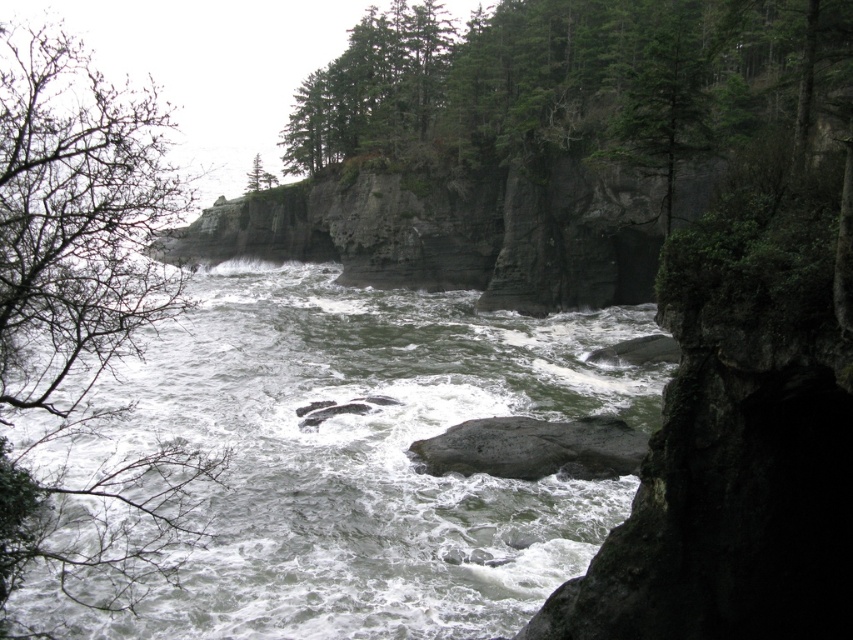
Who is more forward, (109, 211) or (518, 458)?

Point (109, 211) is in front.

Does bare branches at left appear on the left side of gray rough rock at center?

Yes, bare branches at left is to the left of gray rough rock at center.

I want to click on bare branches at left, so click(82, 317).

Is greenish-gray water at center wider than green matte tree at upper center?

No.

Who is higher up, greenish-gray water at center or green matte tree at upper center?

Positioned higher is green matte tree at upper center.

Who is more forward, (329, 593) or (259, 164)?

Point (329, 593) is more forward.

You are a GUI agent. You are given a task and a screenshot of the screen. Output one action in this format:
    pyautogui.click(x=<x>, y=<y>)
    Task: Click on the greenish-gray water at center
    Image resolution: width=853 pixels, height=640 pixels.
    Given the screenshot: What is the action you would take?
    pyautogui.click(x=357, y=460)

Can you confirm if greenish-gray water at center is positioned above bare branches at left?

No.

Which is in front, point (469, 365) or point (148, 164)?

Point (148, 164)

Which is in front, point (244, 541) or point (27, 44)?

Point (27, 44) is in front.

This screenshot has height=640, width=853. In order to click on greenish-gray water at center in this screenshot , I will do `click(357, 460)`.